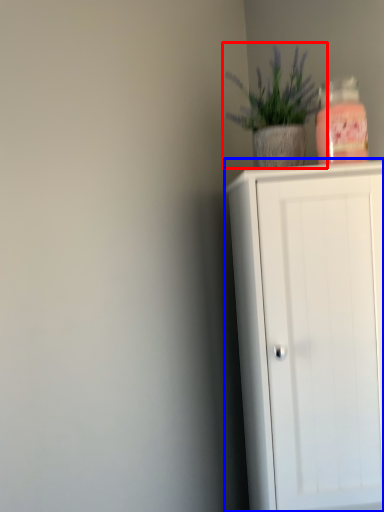
Question: Which point is closer to the camera, houseplant (highlighted by a red box) or cupboard (highlighted by a blue box)?

Choices:
 (A) houseplant
 (B) cupboard

Answer: (B)